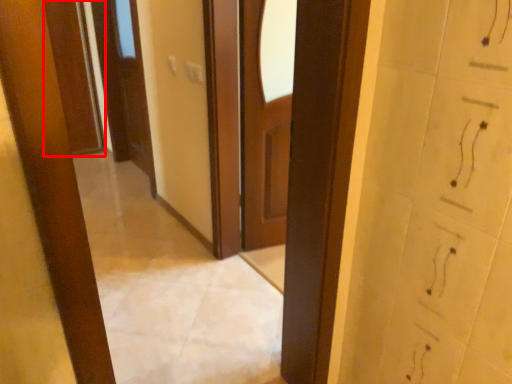
Question: Observing the image, what is the correct spatial positioning of door (annotated by the red box) in reference to door?

Choices:
 (A) right
 (B) left

Answer: (B)